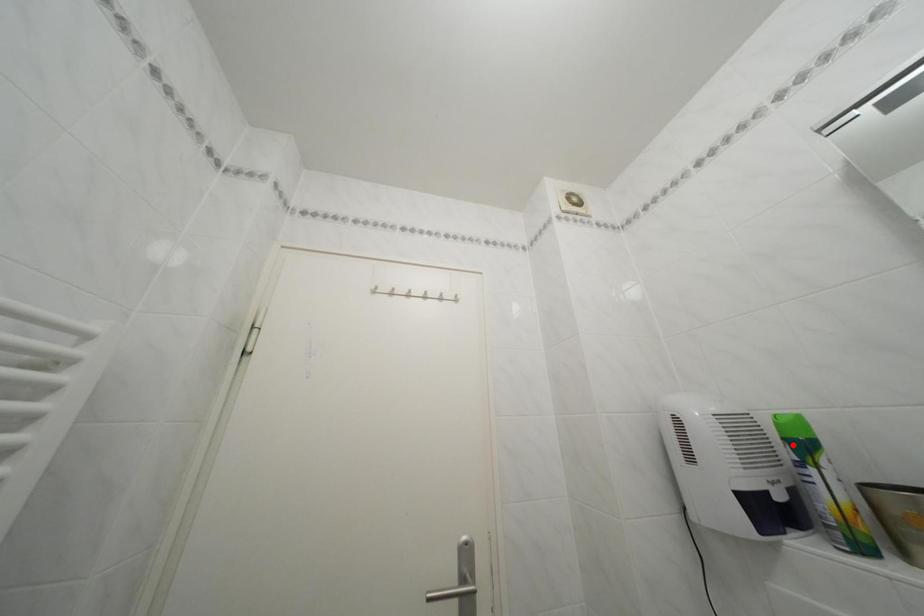
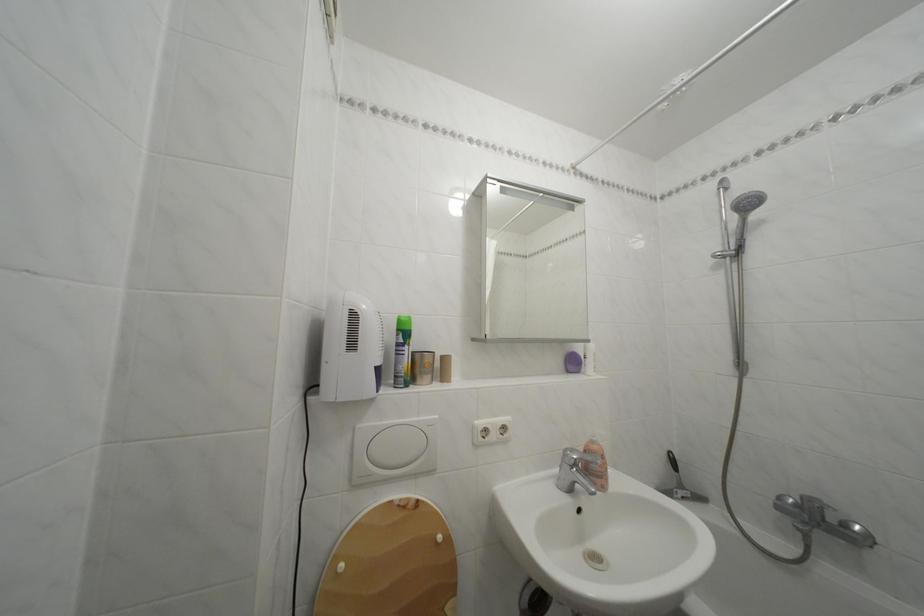
Find the pixel in the second image that matches the highlighted location in the first image.

(407, 336)